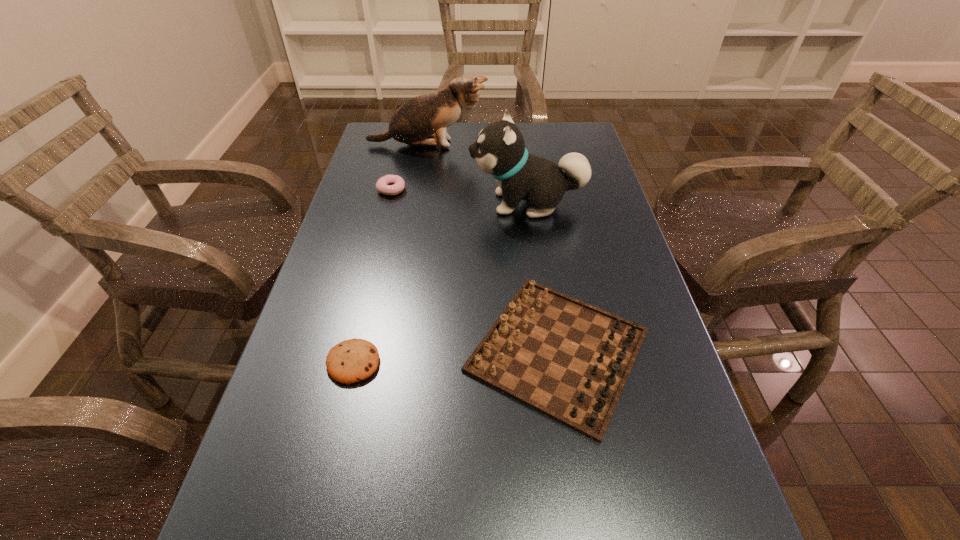
Where is `vacant space at the left edge of the desktop`? This screenshot has height=540, width=960. vacant space at the left edge of the desktop is located at coordinates (331, 285).

Where is `vacant area at the right edge of the desktop`? The image size is (960, 540). vacant area at the right edge of the desktop is located at coordinates (624, 225).

Image resolution: width=960 pixels, height=540 pixels. I want to click on free space between the doughnut and the shortest object, so click(372, 276).

What are the coordinates of `free space between the puppy and the third tallest object` in the screenshot? It's located at (542, 277).

The width and height of the screenshot is (960, 540). Identify the location of empty location between the cookie and the chessboard. 456,356.

Find the location of `free spot between the shortest object and the cat`. free spot between the shortest object and the cat is located at coordinates (390, 254).

I want to click on blank region between the cat and the third shortest object, so click(x=492, y=248).

Identify the location of vacant area between the puppy and the doughnut. (459, 197).

Locate which object ranks second in proximity to the puppy. Please provide its 2D coordinates. Your answer should be formatted as a tuple, i.e. [(x, y)], where the tuple contains the x and y coordinates of a point satisfying the conditions above.

[(415, 122)]

Where is `object that is the second closest to the shortest object`? The width and height of the screenshot is (960, 540). object that is the second closest to the shortest object is located at coordinates (499, 150).